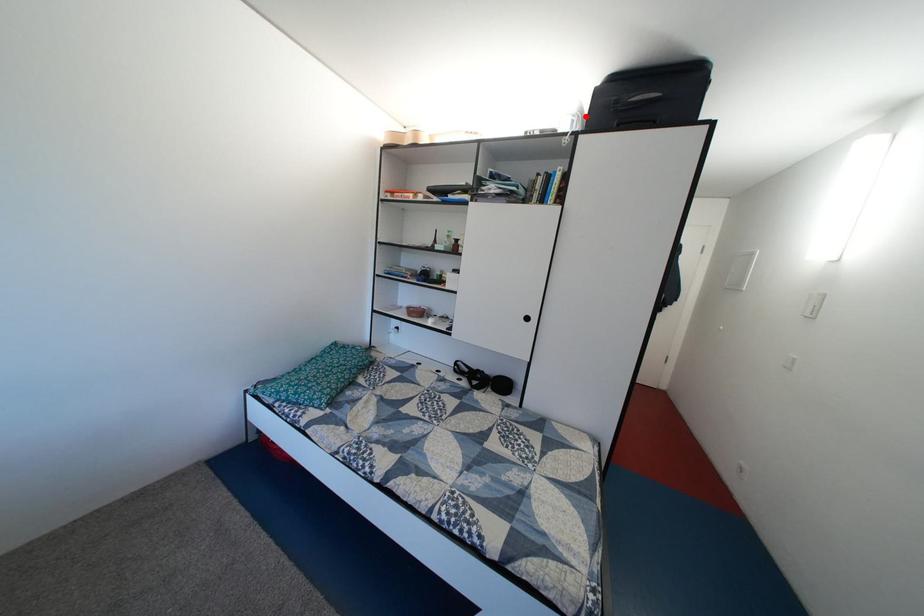
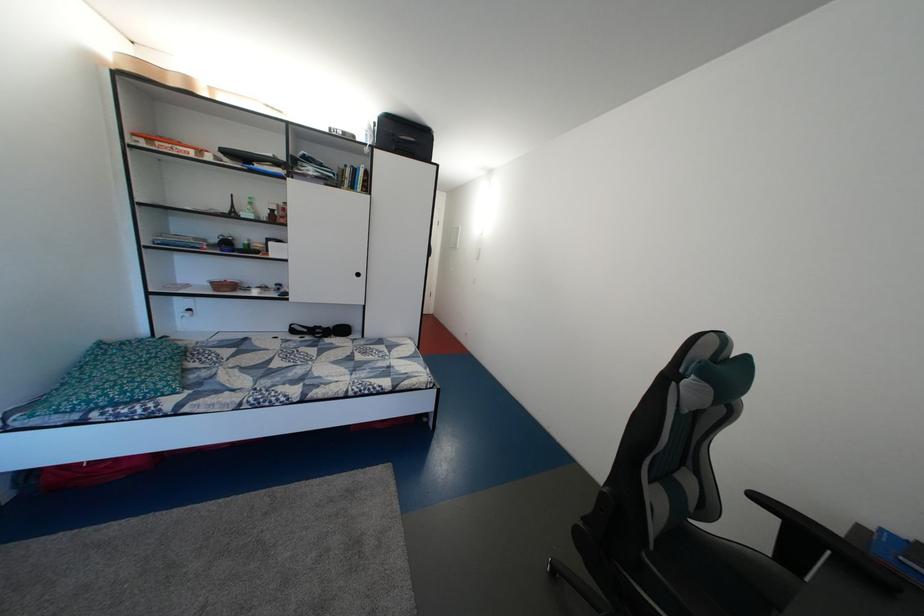
The point at the highlighted location is marked in the first image. Where is the corresponding point in the second image?

(378, 132)